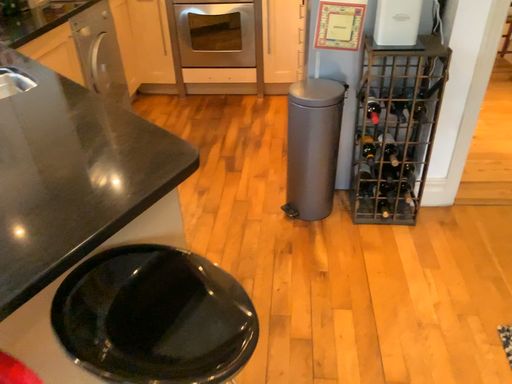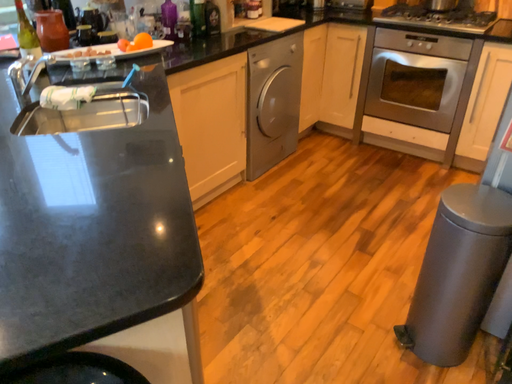
Question: How did the camera likely rotate when shooting the video?

Choices:
 (A) rotated left
 (B) rotated right

Answer: (A)